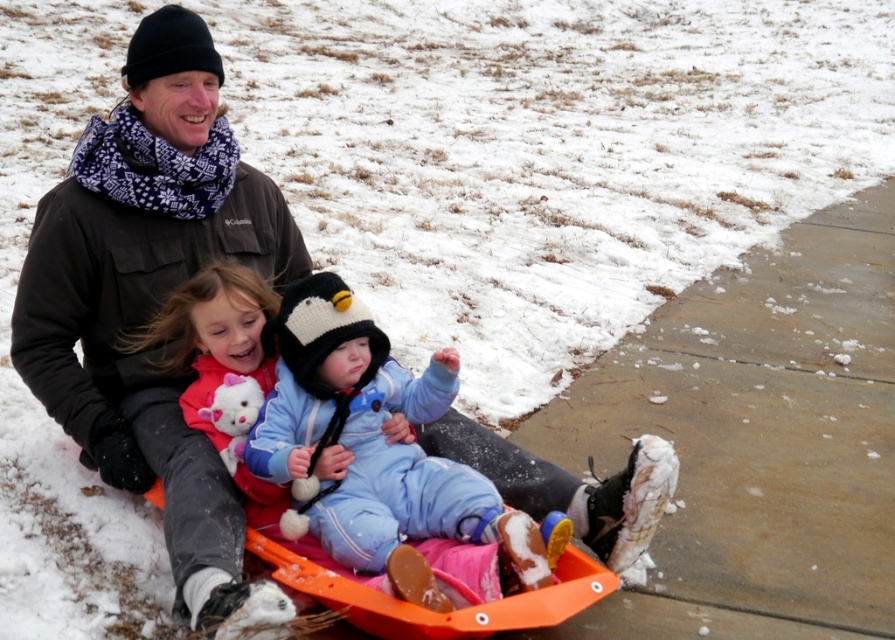
Consider the image. Does dark brown jacket at center appear on the left side of light blue fleece snowsuit at center?

Yes, dark brown jacket at center is to the left of light blue fleece snowsuit at center.

Can you confirm if dark brown jacket at center is wider than light blue fleece snowsuit at center?

Correct, the width of dark brown jacket at center exceeds that of light blue fleece snowsuit at center.

Where is `dark brown jacket at center`? This screenshot has height=640, width=895. dark brown jacket at center is located at coordinates (150, 292).